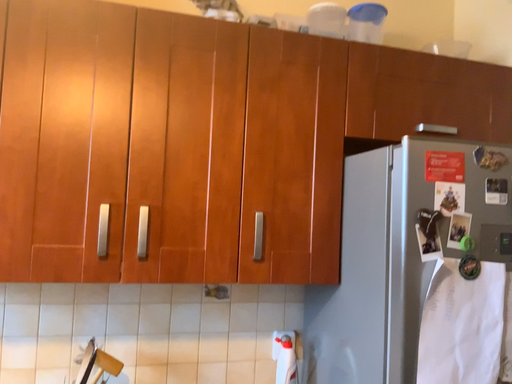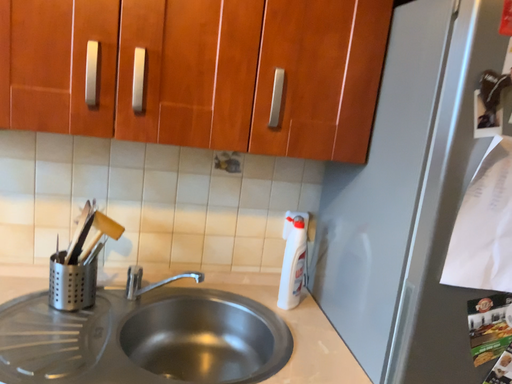
Question: How did the camera likely rotate when shooting the video?

Choices:
 (A) rotated downward
 (B) rotated upward

Answer: (A)